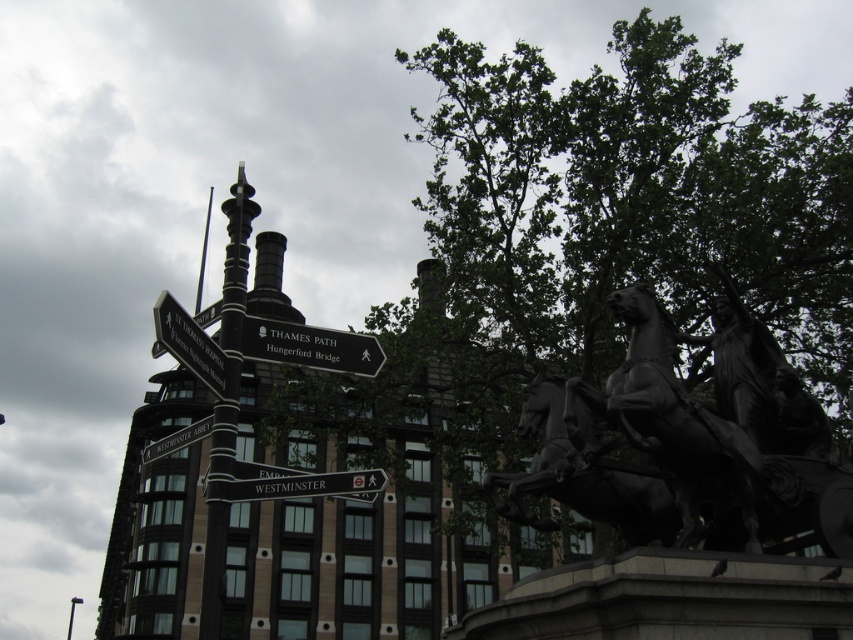
You are a delivery person trying to secure a package to the black polished metal pole at center and the black plastic sign at center. Which object has a narrower width to ensure the package fits properly?

The black polished metal pole at center has a narrower width than the black plastic sign at center, so the package should be secured to it to ensure it fits properly.

You are a tourist trying to find the nearest subway station. You see the black metal signpost at upper left and the black metal sign at upper left. Which one should you look at for directions?

You should look at the black metal sign at upper left because the black metal signpost at upper left is located above it, so the lower one might have more immediate directions.